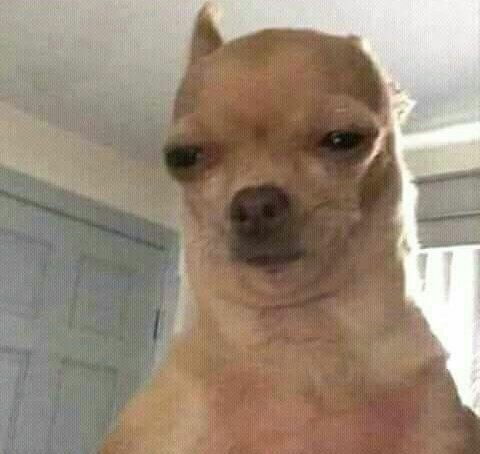
Image resolution: width=480 pixels, height=454 pixels. I want to click on door hinge, so click(158, 328).